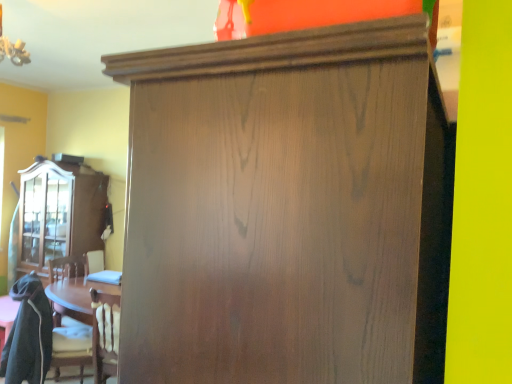
Question: Is matte wood cabinet at left looking in the opposite direction of wooden swivel chair at lower left?

Choices:
 (A) no
 (B) yes

Answer: (A)

Question: Considering the relative sizes of matte wood cabinet at left and wooden swivel chair at lower left in the image provided, is matte wood cabinet at left bigger than wooden swivel chair at lower left?

Choices:
 (A) yes
 (B) no

Answer: (A)

Question: Can we say matte wood cabinet at left lies outside wooden swivel chair at lower left?

Choices:
 (A) yes
 (B) no

Answer: (A)

Question: From a real-world perspective, is matte wood cabinet at left positioned over wooden swivel chair at lower left based on gravity?

Choices:
 (A) yes
 (B) no

Answer: (A)

Question: Can you confirm if matte wood cabinet at left is taller than wooden swivel chair at lower left?

Choices:
 (A) yes
 (B) no

Answer: (A)

Question: Is wooden swivel chair at lower left inside the boundaries of satin wood cupboard at center, or outside?

Choices:
 (A) outside
 (B) inside

Answer: (A)

Question: Considering the positions of wooden swivel chair at lower left and satin wood cupboard at center in the image, is wooden swivel chair at lower left bigger or smaller than satin wood cupboard at center?

Choices:
 (A) big
 (B) small

Answer: (B)

Question: Is wooden swivel chair at lower left in front of or behind satin wood cupboard at center in the image?

Choices:
 (A) front
 (B) behind

Answer: (B)

Question: Does point (31, 365) appear closer or farther from the camera than point (262, 223)?

Choices:
 (A) closer
 (B) farther

Answer: (B)

Question: From the image's perspective, is wooden swivel chair at lower left located above or below matte wood cabinet at left?

Choices:
 (A) above
 (B) below

Answer: (B)

Question: From a real-world perspective, relative to matte wood cabinet at left, is wooden swivel chair at lower left vertically above or below?

Choices:
 (A) above
 (B) below

Answer: (B)

Question: Is wooden swivel chair at lower left in front of or behind matte wood cabinet at left in the image?

Choices:
 (A) front
 (B) behind

Answer: (A)

Question: Based on their sizes in the image, would you say wooden swivel chair at lower left is bigger or smaller than matte wood cabinet at left?

Choices:
 (A) small
 (B) big

Answer: (A)

Question: Is satin wood cupboard at center to the left or to the right of wooden swivel chair at lower left in the image?

Choices:
 (A) right
 (B) left

Answer: (A)

Question: Is satin wood cupboard at center situated inside wooden swivel chair at lower left or outside?

Choices:
 (A) inside
 (B) outside

Answer: (B)